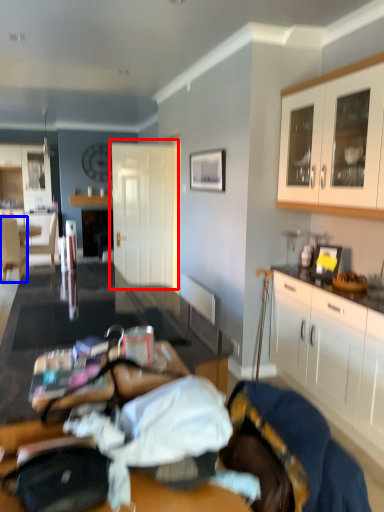
Question: Among these objects, which one is nearest to the camera, door (highlighted by a red box) or chair (highlighted by a blue box)?

Choices:
 (A) door
 (B) chair

Answer: (A)